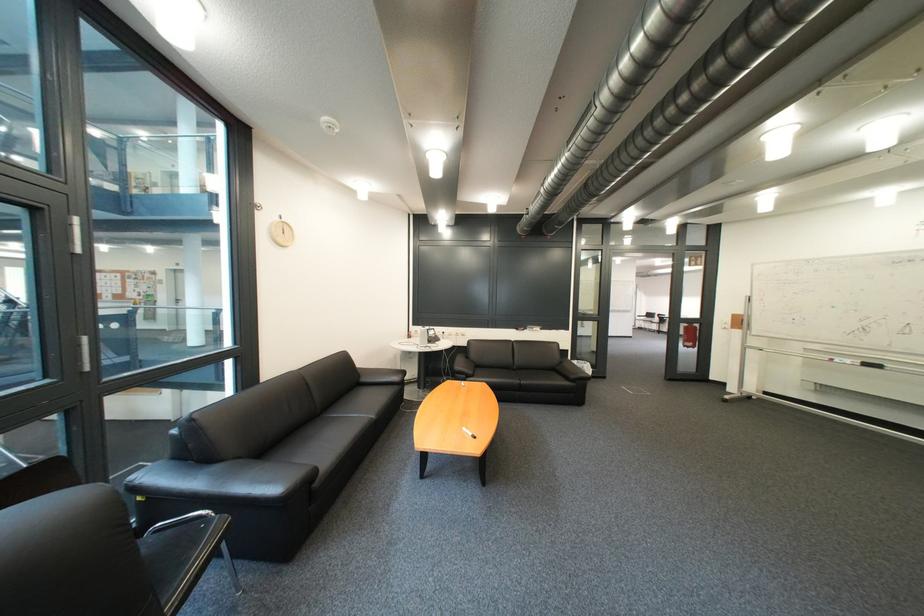
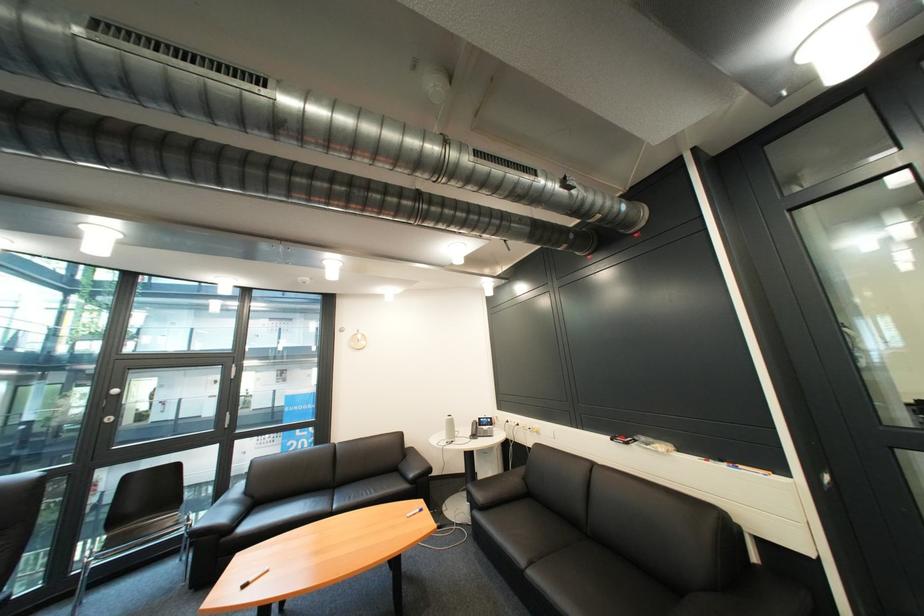
Locate, in the second image, the point that corresponds to [456,334] in the first image.

(531, 426)